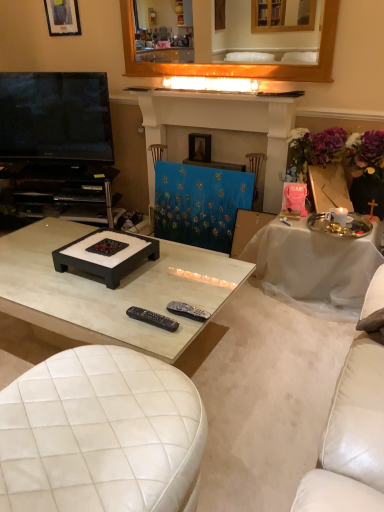
This screenshot has width=384, height=512. Identify the location of spots to the right of black plastic remote control at center, which ranks as the second remote control in right-to-left order. (193, 317).